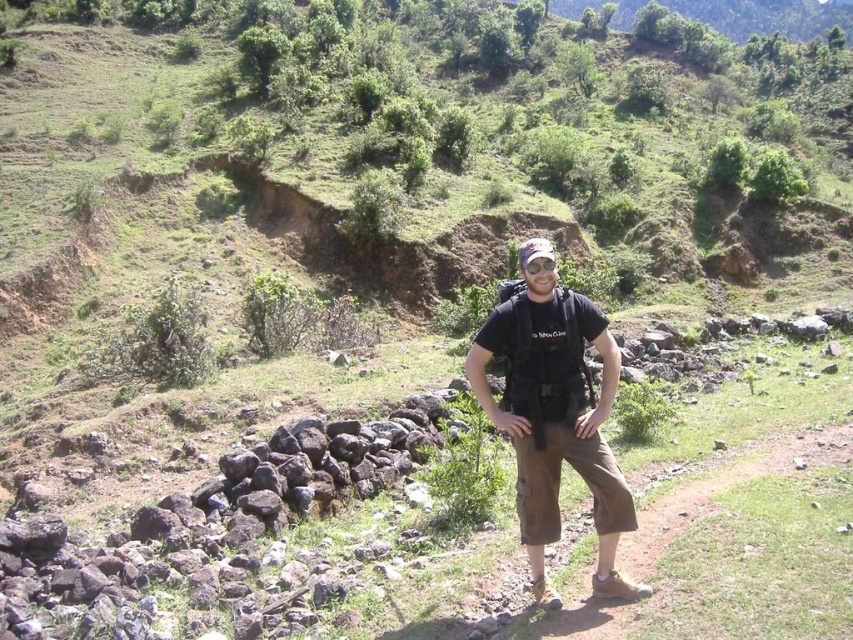
You are a hiker trying to navigate the terrain. You notice two points marked on your map corresponding to coordinates in the image. The first point is at point (486,403) and the second is at point (585,618). Which point is closer to you as you stand on the trail?

Point (486,403) is closer to you because it is further to the viewer than point (585,618).

You are a photographer trying to capture the person in the scene. Since both the brown cotton cargo pants at center and the brown fabric pants at center are in the frame, which one appears closer to the camera?

The brown cotton cargo pants at center appears closer to the camera because the brown fabric pants at center is behind it.